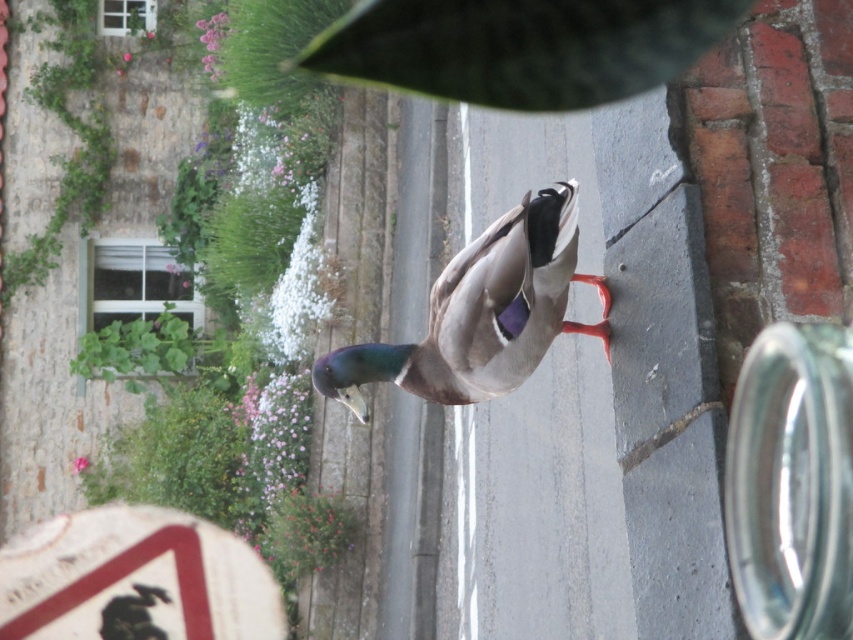
Looking at this image, you are a photographer trying to capture a closeup of the shiny brown duck at center. Your camera has a minimum focusing distance of 16 feet. Will you be able to take the photo without moving closer?

The shiny brown duck at center and camera are 15.70 feet apart, which is less than the camera minimum focusing distance of 16 feet. Therefore, you can take the photo without moving closer.

You are standing at the brick wall and want to walk towards the signpost in the foreground. Which point, point (517,280) or point (171,348), is closer to your path?

Point (171,348) is closer to your path because it is behind point (517,280), which is in front of it.

In the scene shown: You are a photographer trying to capture both the shiny brown duck at center and the green leafy plant at upper left in a single frame. Based on their sizes in the image, which one would you need to focus on more closely to ensure it appears large enough in the photo?

The shiny brown duck at center occupies less space than the green leafy plant at upper left, so you would need to focus more closely on the shiny brown duck at center to make it appear larger in the photo.